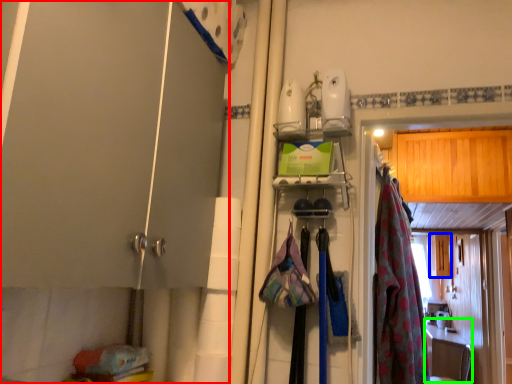
Question: Which is nearer to the door (highlighted by a red box)? cabinetry (highlighted by a blue box) or counter top (highlighted by a green box).

Choices:
 (A) cabinetry
 (B) counter top

Answer: (A)